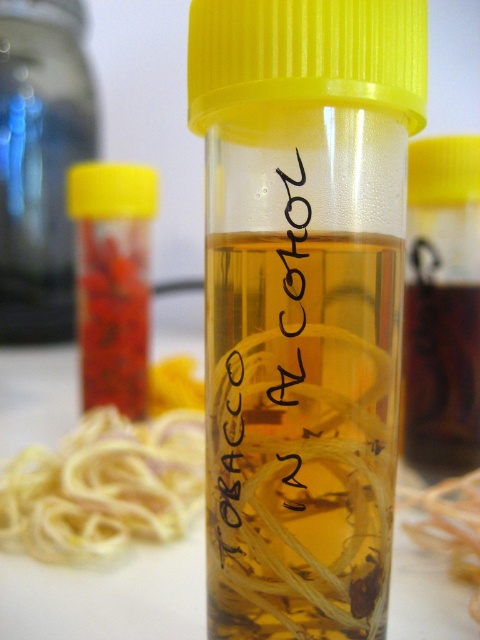
Question: Can you confirm if translucent plastic tube at center is smaller than yellow rubber band at lower left?

Choices:
 (A) no
 (B) yes

Answer: (B)

Question: Is yellow rubber band at lower left below brown translucent bottle at center?

Choices:
 (A) no
 (B) yes

Answer: (B)

Question: Which object is closer to the camera taking this photo?

Choices:
 (A) translucent plastic bottle at left
 (B) translucent plastic tube at center
 (C) yellow rubber band at lower left

Answer: (B)

Question: Which point is farther to the camera?

Choices:
 (A) (254, 216)
 (B) (119, 456)

Answer: (B)

Question: Does translucent plastic tube at center have a lesser width compared to translucent plastic bottle at left?

Choices:
 (A) yes
 (B) no

Answer: (A)

Question: Which object is positioned farthest from the translucent plastic tube at center?

Choices:
 (A) brown translucent bottle at center
 (B) translucent plastic container at center
 (C) yellow rubber band at lower left
 (D) translucent plastic bottle at left

Answer: (D)